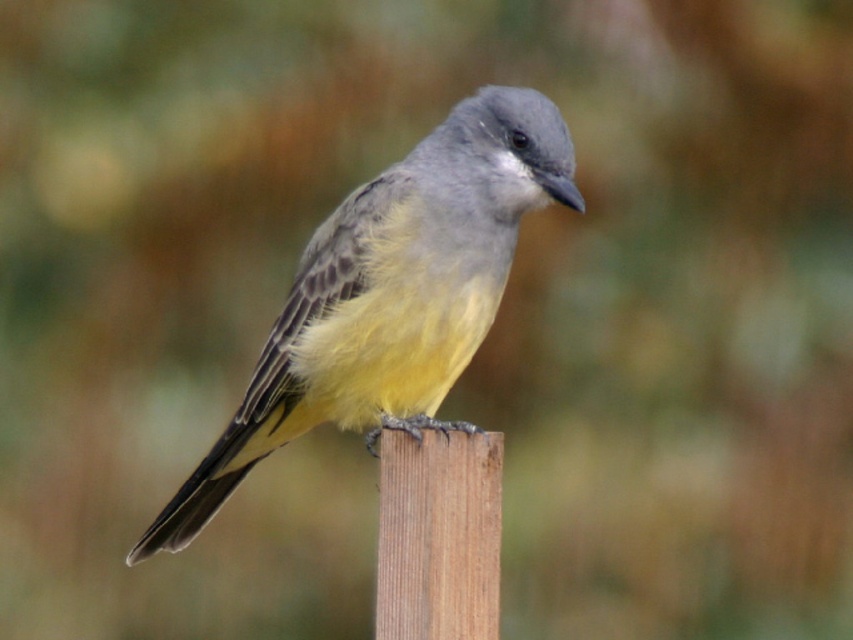
You are a photographer trying to capture the bird in the image. You notice a point at coordinates point (390, 294). What part of the bird is located at this point?

The point (390, 294) is located on the yellow and gray feathers at the center of the bird.